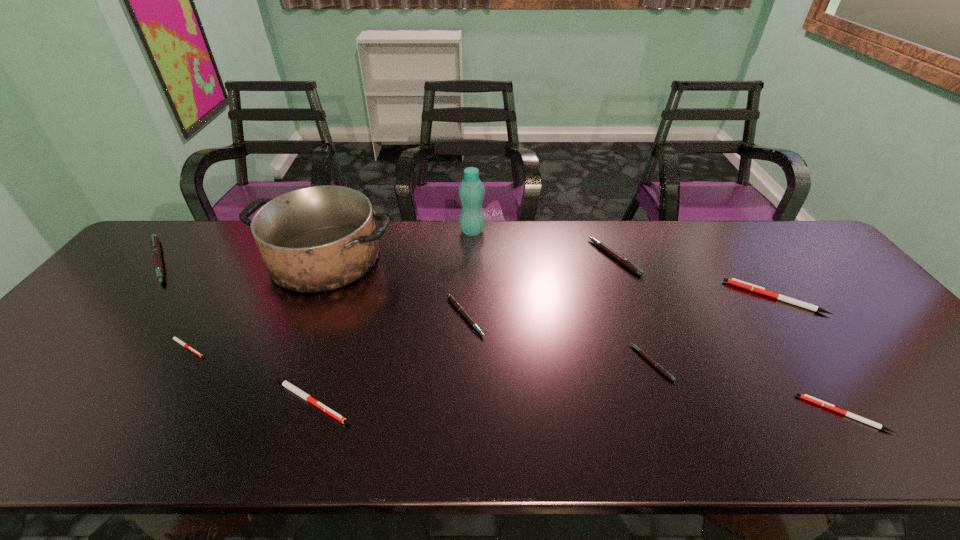
Select which object appears as the third closest to the third biggest white pen. Please provide its 2D coordinates. Your answer should be formatted as a tuple, i.e. [(x, y)], where the tuple contains the x and y coordinates of a point satisfying the conditions above.

[(619, 258)]

Identify which pen is the second nearest to the second biggest pink pen. Please provide its 2D coordinates. Your answer should be formatted as a tuple, i.e. [(x, y)], where the tuple contains the x and y coordinates of a point satisfying the conditions above.

[(658, 366)]

At what (x,y) coordinates should I click in order to perform the action: click on pen that is the fifth closest to the smallest white pen. Please return your answer as a coordinate pair (x, y). Looking at the image, I should click on point(619,258).

You are a GUI agent. You are given a task and a screenshot of the screen. Output one action in this format:
    pyautogui.click(x=<x>, y=<y>)
    Task: Click on the fourth closest pink pen to the leftmost white pen
    The height and width of the screenshot is (540, 960).
    Given the screenshot: What is the action you would take?
    pyautogui.click(x=619, y=258)

Locate which pink pen is the closest to the shortest object. Please provide its 2D coordinates. Your answer should be formatted as a tuple, i.e. [(x, y)], where the tuple contains the x and y coordinates of a point satisfying the conditions above.

[(155, 245)]

The image size is (960, 540). Find the location of `the fourth closest white pen to the third biggest pink pen`. the fourth closest white pen to the third biggest pink pen is located at coordinates (809, 398).

Identify the location of white pen that is the third closest to the second white pen from left to right. (733, 281).

Identify the location of free spot that satisfies the following two spatial constraints: 1. on the front side of the tallest object; 2. on the clicker of the sixth pen from right to left. (468, 401).